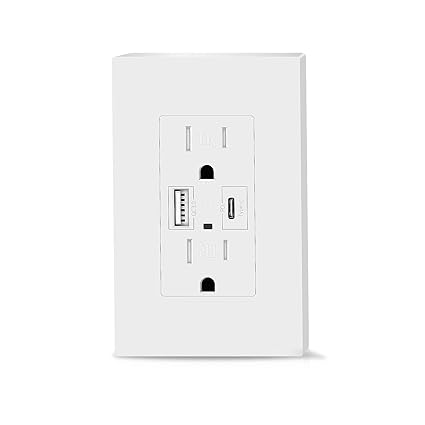
Where is `white socket`? The height and width of the screenshot is (425, 425). white socket is located at coordinates (218, 322).